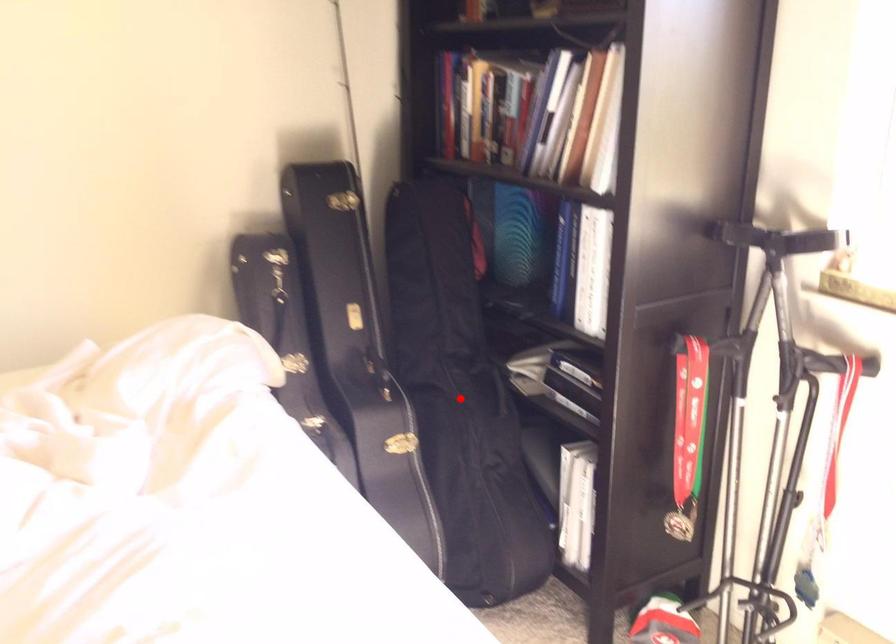
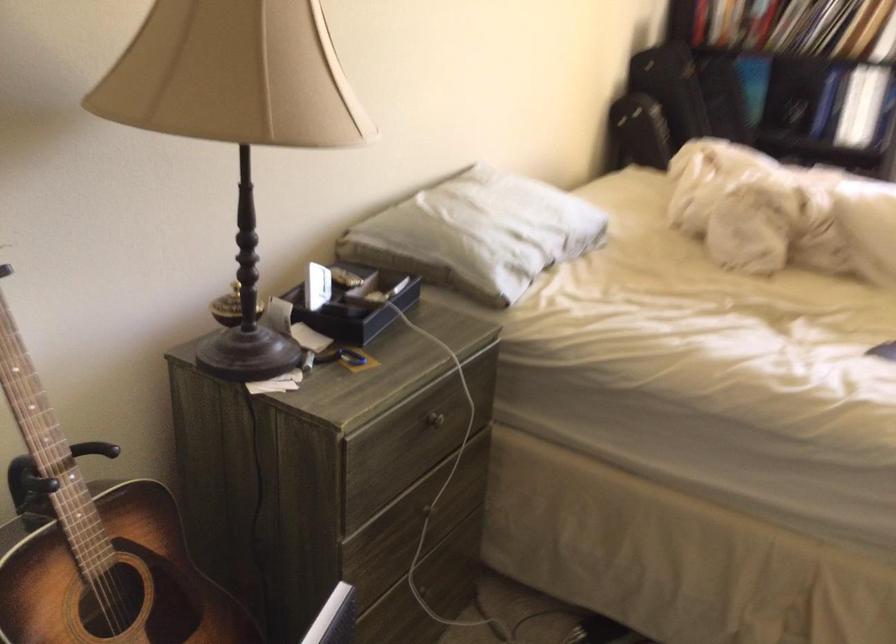
Question: I am providing you with two images of the same scene from different viewpoints. A red point is marked on the first image. Can you still see the location of the red point in image 2?

Choices:
 (A) Yes
 (B) No

Answer: (B)